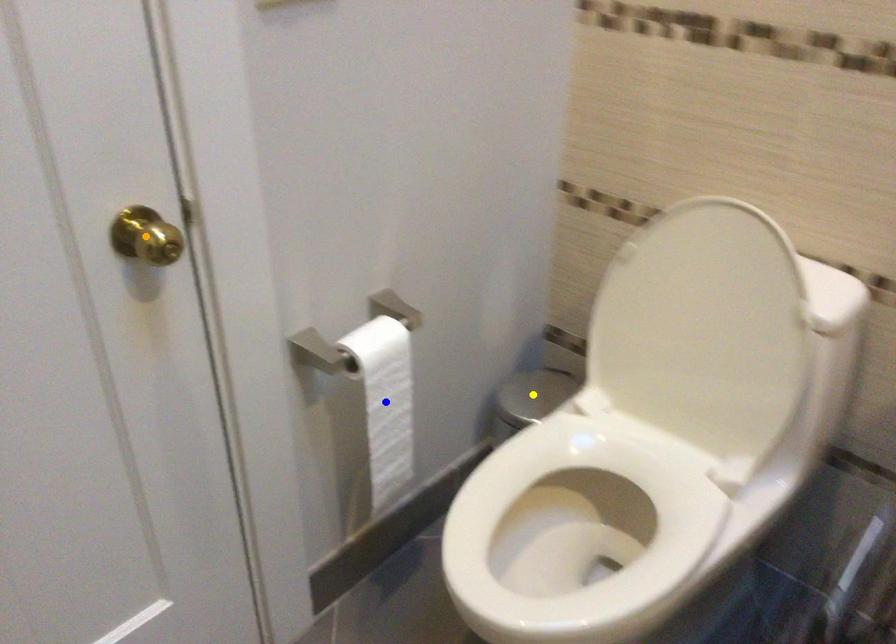
Order these from nearest to farthest:
blue point
orange point
yellow point

yellow point < blue point < orange point